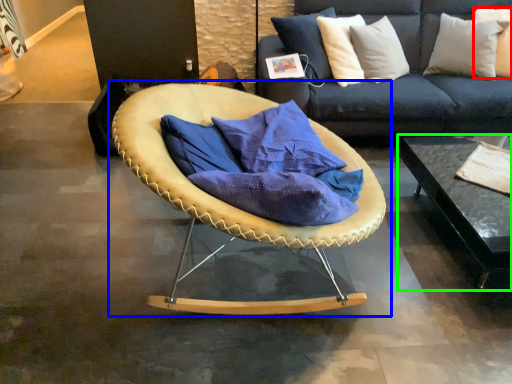
Question: Estimate the real-world distances between objects in this image. Which object is closer to pillow (highlighted by a red box), chair (highlighted by a blue box) or table (highlighted by a green box)?

Choices:
 (A) chair
 (B) table

Answer: (B)